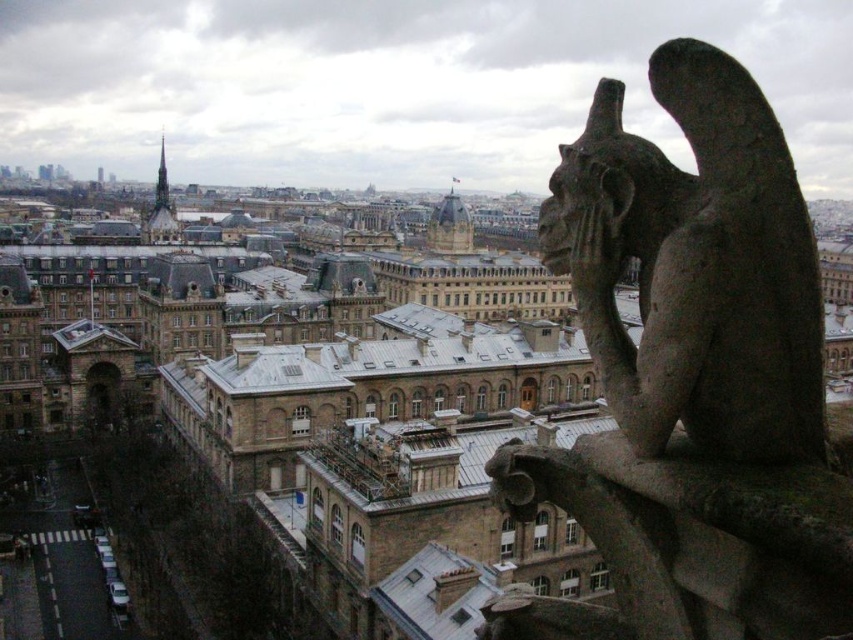
Between dark gray stone gargoyle at upper right and golden stone tower at center, which one appears on the left side from the viewer's perspective?

Positioned to the left is dark gray stone gargoyle at upper right.

Can you confirm if dark gray stone gargoyle at upper right is positioned to the right of golden stone tower at center?

In fact, dark gray stone gargoyle at upper right is to the left of golden stone tower at center.

Between point (677, 460) and point (451, 204), which one is positioned behind?

Point (451, 204)

In order to click on dark gray stone gargoyle at upper right in this screenshot , I will do `click(691, 378)`.

Who is higher up, golden stone tower at center or smooth gray stone tower at upper left?

golden stone tower at center is above.

Does point (457, 212) come farther from viewer compared to point (178, 236)?

No, it is in front of (178, 236).

I want to click on golden stone tower at center, so click(x=450, y=225).

Does dark gray stone gargoyle at upper right appear under smooth gray stone tower at upper left?

Yes, dark gray stone gargoyle at upper right is below smooth gray stone tower at upper left.

Between point (669, 182) and point (167, 224), which one is positioned behind?

Positioned behind is point (167, 224).

You are a GUI agent. You are given a task and a screenshot of the screen. Output one action in this format:
    pyautogui.click(x=<x>, y=<y>)
    Task: Click on the dark gray stone gargoyle at upper right
    This screenshot has width=853, height=640.
    Given the screenshot: What is the action you would take?
    pyautogui.click(x=691, y=378)